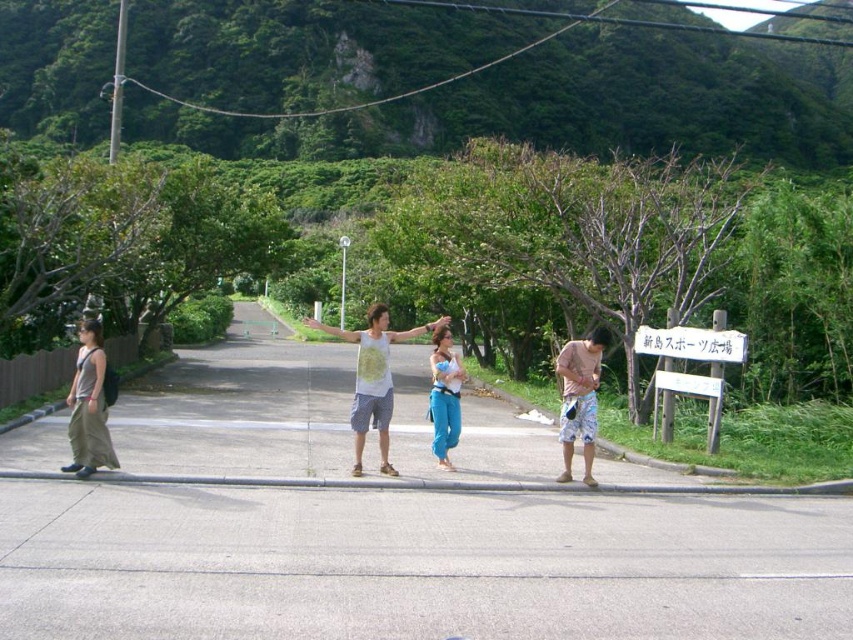
Who is taller, white plastic sign at center or white wooden sign at center?

white wooden sign at center

Does white plastic sign at center have a lesser width compared to white wooden sign at center?

Correct, white plastic sign at center's width is less than white wooden sign at center's.

Who is more distant from viewer, (643,339) or (341,307)?

The point (341,307) is behind.

Identify the location of white plastic sign at center. This screenshot has width=853, height=640. (691, 342).

Between matte gray tank top at left and white plastic sign at center, which one is positioned lower?

matte gray tank top at left is lower down.

Does point (65, 467) come closer to viewer compared to point (657, 340)?

Yes, it is.

Does point (88, 417) lie behind point (729, 340)?

No, (88, 417) is in front of (729, 340).

Identify the location of matte gray tank top at left. (90, 404).

Is matte gray tank top at left to the left of light brown shorts at right from the viewer's perspective?

Yes, matte gray tank top at left is to the left of light brown shorts at right.

Is matte gray tank top at left to the right of light brown shorts at right from the viewer's perspective?

Incorrect, matte gray tank top at left is not on the right side of light brown shorts at right.

Image resolution: width=853 pixels, height=640 pixels. Describe the element at coordinates (90, 404) in the screenshot. I see `matte gray tank top at left` at that location.

You are a GUI agent. You are given a task and a screenshot of the screen. Output one action in this format:
    pyautogui.click(x=<x>, y=<y>)
    Task: Click on the matte gray tank top at left
    Image resolution: width=853 pixels, height=640 pixels.
    Given the screenshot: What is the action you would take?
    pyautogui.click(x=90, y=404)